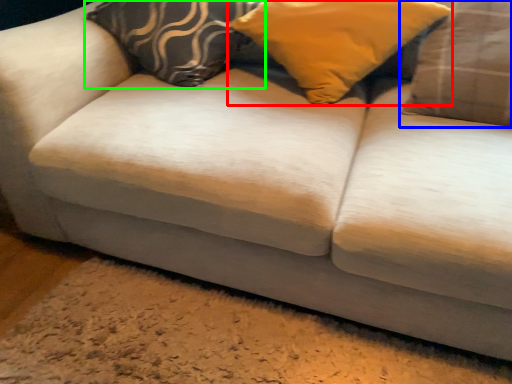
Question: Based on their relative distances, which object is farther from pillow (highlighted by a red box)? Choose from pillow (highlighted by a blue box) and pillow (highlighted by a green box).

Choices:
 (A) pillow
 (B) pillow

Answer: (B)